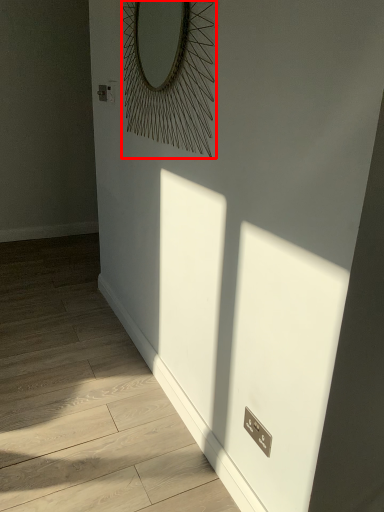
Question: Considering the relative positions of mirror (annotated by the red box) and corridor in the image provided, where is mirror (annotated by the red box) located with respect to the staircase?

Choices:
 (A) right
 (B) left

Answer: (A)